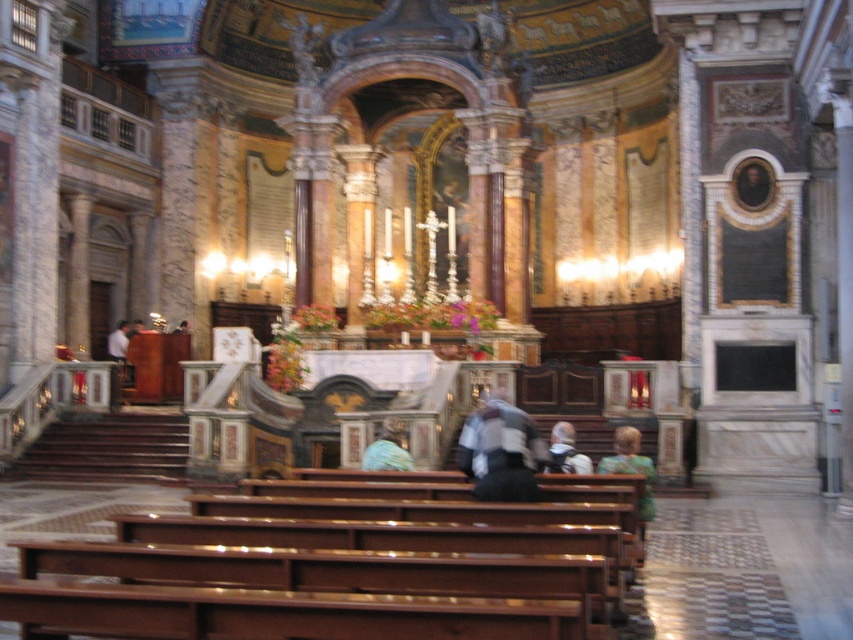
You are an interior designer observing the church scene. You notice the light blue fabric at center and the white fabric shirt at left. Which fabric is positioned lower in the scene?

The light blue fabric at center is positioned lower than the white fabric shirt at left.

You are standing in the church and want to pick up the green textured sweater at lower center and the white fabric shirt at left. Which one can you reach without moving closer to the altar?

The green textured sweater at lower center is closer to the viewer, so you can reach it without moving closer to the altar, but the white fabric shirt at left is farther away and would require moving closer.